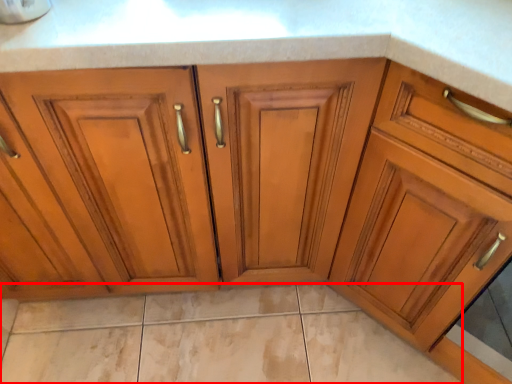
Question: From the image's perspective, what is the correct spatial relationship of granite (annotated by the red box) in relation to cabinetry?

Choices:
 (A) above
 (B) below

Answer: (B)